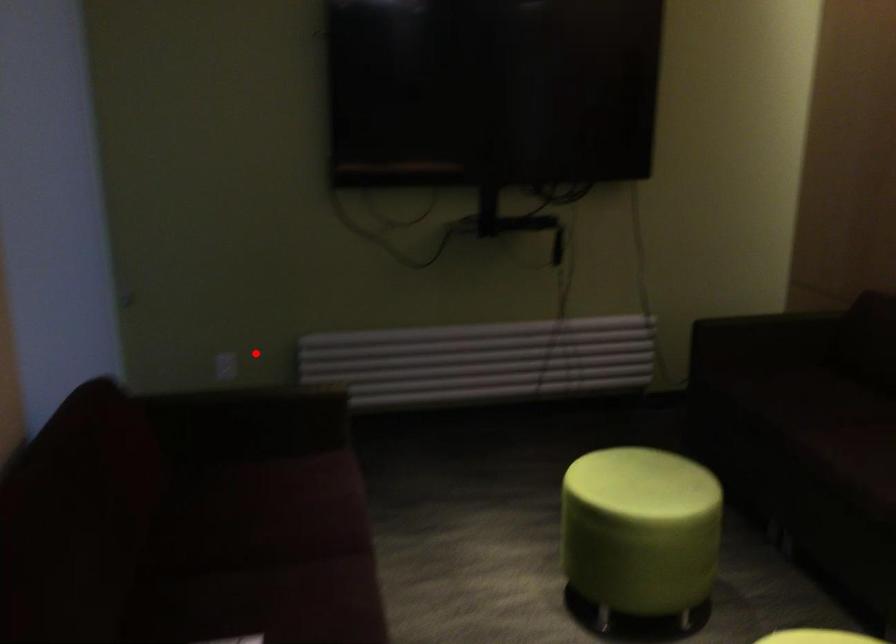
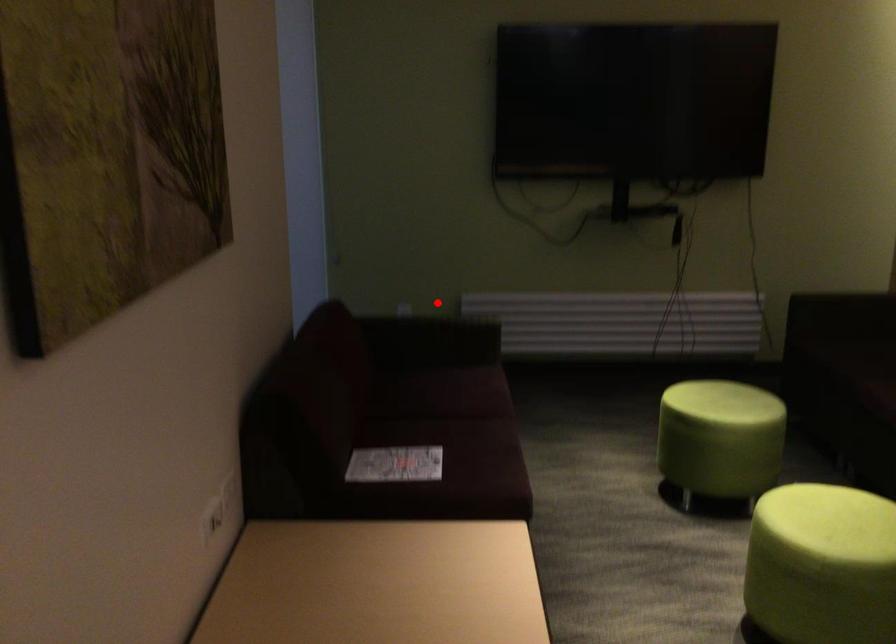
I am providing you with two images of the same scene from different viewpoints. A red point is marked on the first image and another point is marked on the second image. Do the highlighted points in image1 and image2 indicate the same real-world spot?

Yes